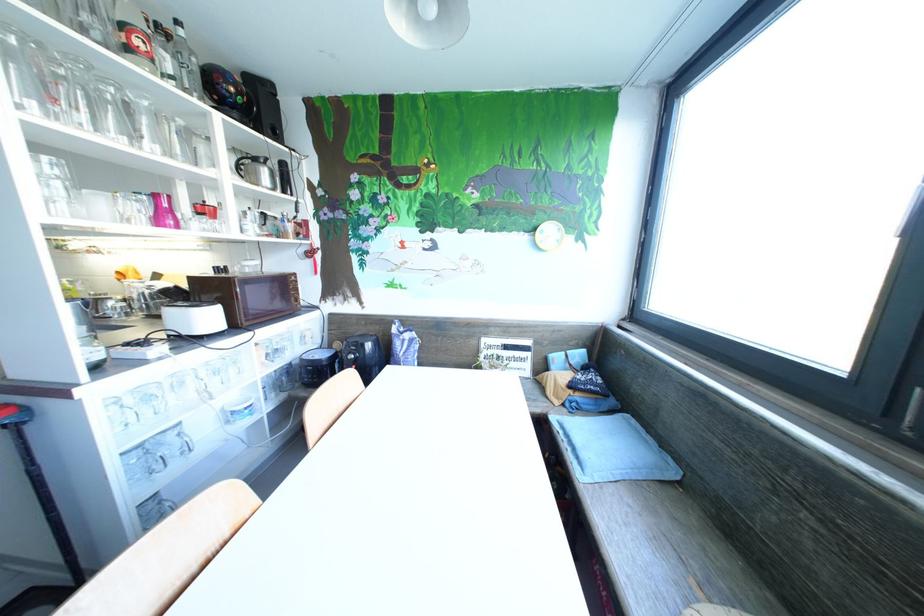
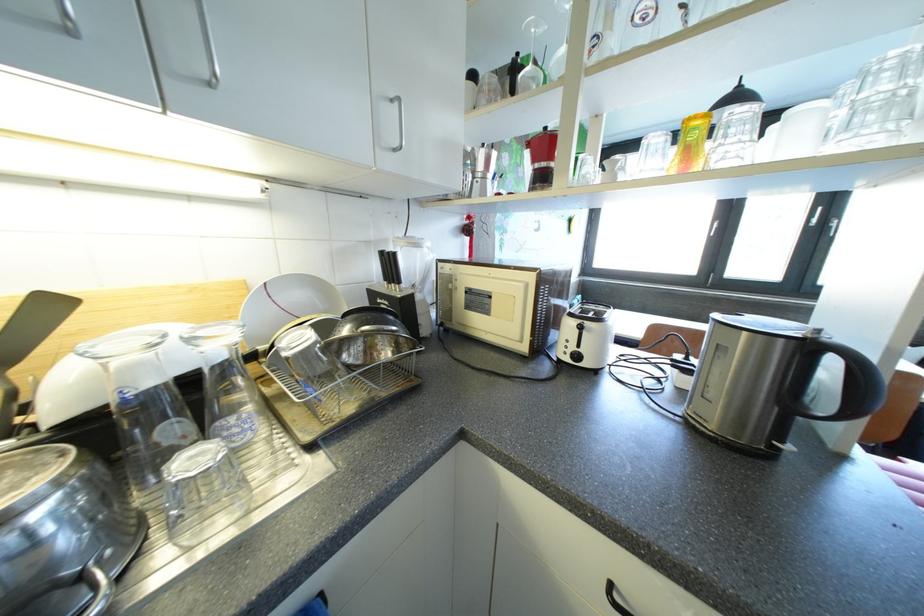
Question: I am providing you with two images of the same scene from different viewpoints. Which of the following objects are not visible in image2?

Choices:
 (A) black window handle
 (B) chair sitting surface
 (C) printer side handle
 (D) white plate

Answer: (B)